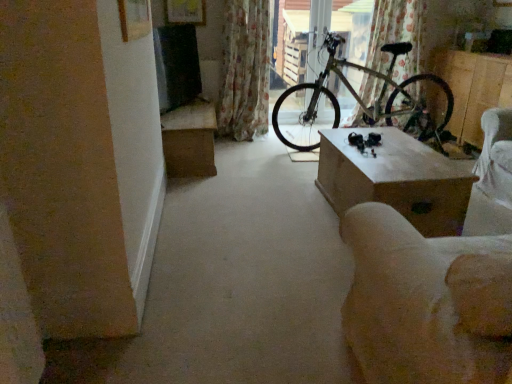
Question: Can you confirm if metallic bicycle at center is taller than floral fabric curtain at center, marked as the 2th curtain in a right-to-left arrangement?

Choices:
 (A) yes
 (B) no

Answer: (A)

Question: From the image's perspective, would you say metallic bicycle at center is positioned over floral fabric curtain at center, marked as the first curtain in a left-to-right arrangement?

Choices:
 (A) yes
 (B) no

Answer: (A)

Question: Is floral fabric curtain at center, marked as the 2th curtain in a right-to-left arrangement, inside metallic bicycle at center?

Choices:
 (A) no
 (B) yes

Answer: (A)

Question: Is metallic bicycle at center looking in the opposite direction of floral fabric curtain at center, marked as the 2th curtain in a right-to-left arrangement?

Choices:
 (A) yes
 (B) no

Answer: (B)

Question: Is metallic bicycle at center shorter than floral fabric curtain at center, marked as the first curtain in a left-to-right arrangement?

Choices:
 (A) no
 (B) yes

Answer: (A)

Question: Does metallic bicycle at center have a larger size compared to floral fabric curtain at center, marked as the first curtain in a left-to-right arrangement?

Choices:
 (A) yes
 (B) no

Answer: (B)

Question: From a real-world perspective, is wooden table at center, which appears as the 1th table when viewed from the right, positioned under green metallic bicycle at center based on gravity?

Choices:
 (A) yes
 (B) no

Answer: (A)

Question: Is wooden table at center, placed as the first table when sorted from front to back, completely or partially outside of green metallic bicycle at center?

Choices:
 (A) no
 (B) yes

Answer: (B)

Question: Is green metallic bicycle at center located within wooden table at center, the 2th table viewed from the back?

Choices:
 (A) yes
 (B) no

Answer: (B)

Question: Is wooden table at center, the second table in the left-to-right sequence, shorter than green metallic bicycle at center?

Choices:
 (A) yes
 (B) no

Answer: (A)

Question: From the image's perspective, does wooden table at center, the second table in the left-to-right sequence, appear higher than green metallic bicycle at center?

Choices:
 (A) no
 (B) yes

Answer: (A)

Question: Is wooden table at center, placed as the first table when sorted from front to back, positioned before green metallic bicycle at center?

Choices:
 (A) yes
 (B) no

Answer: (A)

Question: Is metallic bicycle at center outside of wooden box at right?

Choices:
 (A) no
 (B) yes

Answer: (B)